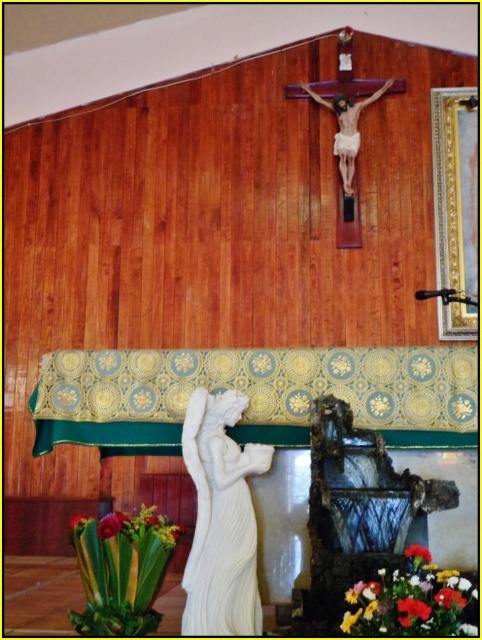
You are a maintenance worker in the church and need to move the white marble statue at center and the green leafy plant at lower left to clean the floor underneath. Based on their widths, which object requires more space to move aside?

The white marble statue at center might be wider than the green leafy plant at lower left, so it likely requires more space to move aside.

You are an interior designer planning to place a new decorative item exactly halfway between the wooden crucifix at upper center and the red matte flower at lower right. What is the minimum distance you need to measure from each object to ensure the item is centered?

The distance between the wooden crucifix at upper center and the red matte flower at lower right is 4.01 meters. To place the item halfway, you need to measure 2.005 meters from each object.